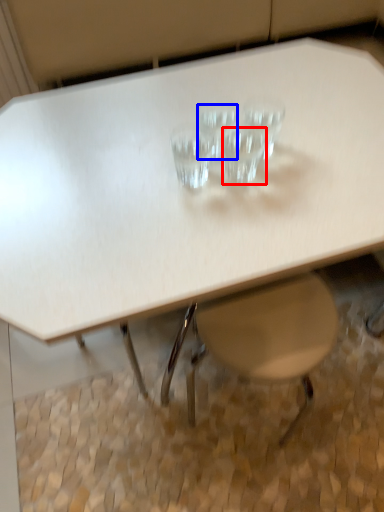
Question: Which object appears farthest to the camera in this image, martini glass (highlighted by a red box) or martini glass (highlighted by a blue box)?

Choices:
 (A) martini glass
 (B) martini glass

Answer: (B)